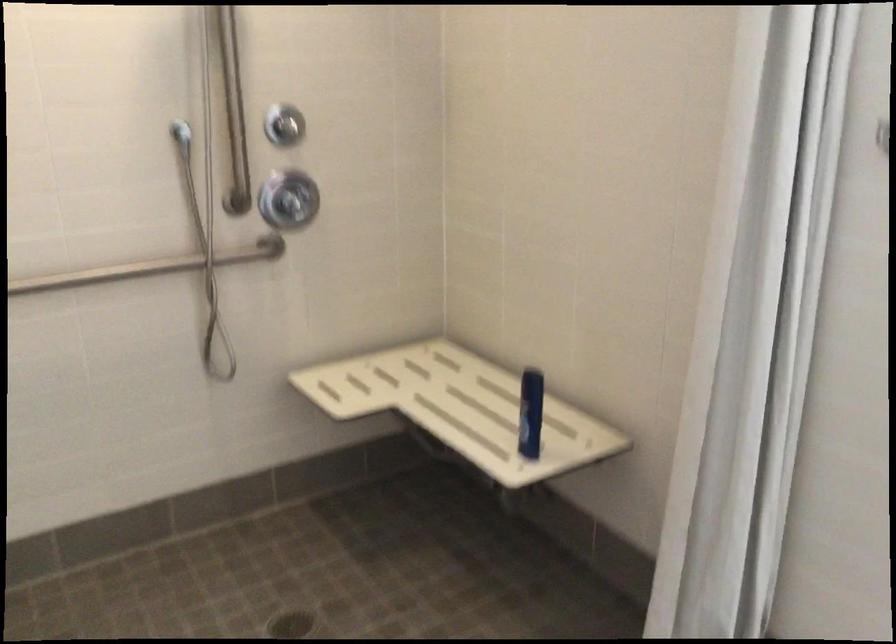
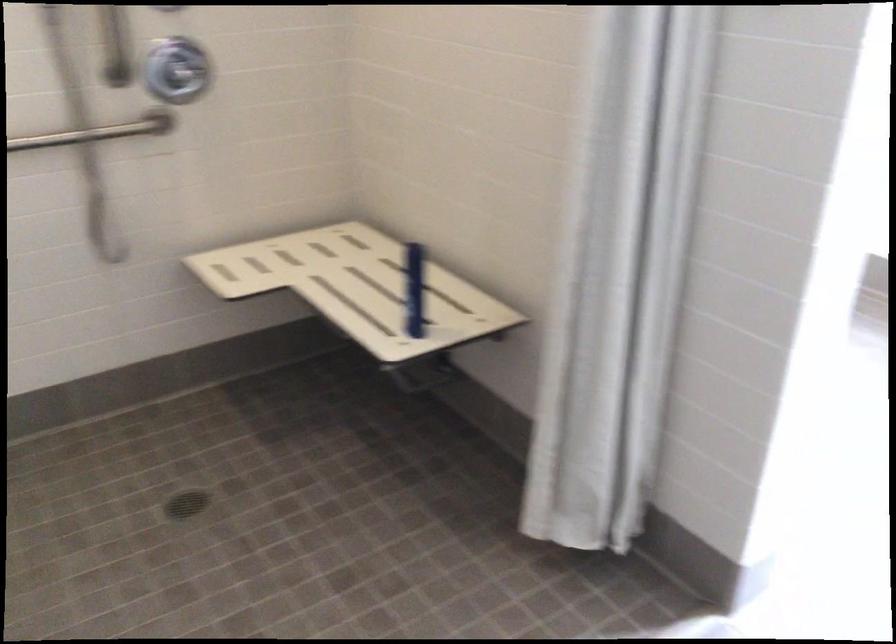
Find the pixel in the second image that matches the point at 216,257 in the first image.

(98, 131)